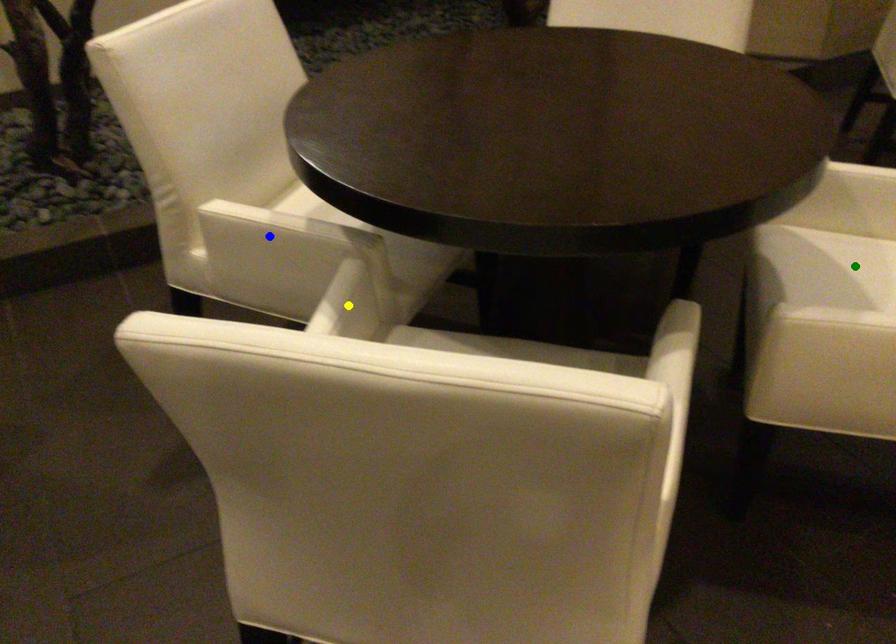
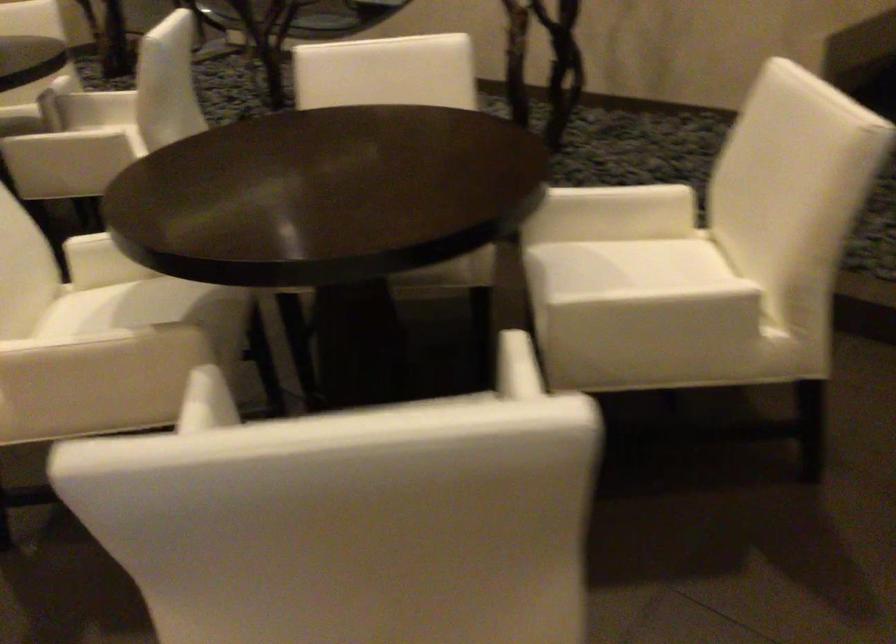
I am providing you with two images of the same scene from different viewpoints. Three points are marked in image1. Which point corresponds to a part or object that is occluded in image2?In image1, three points are marked. Which of them correspond to a part or object that is occluded in image2?Among the three points shown in image1, which one corresponds to a part or object that is no longer visible due to occlusion in image2?

green point, yellow point, blue point cannot be seen in image2.